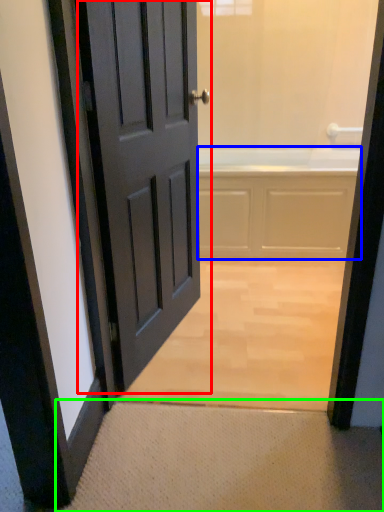
Question: Based on their relative distances, which object is nearer to door (highlighted by a red box)? Choose from bath (highlighted by a blue box) and doormat (highlighted by a green box).

Choices:
 (A) bath
 (B) doormat

Answer: (B)